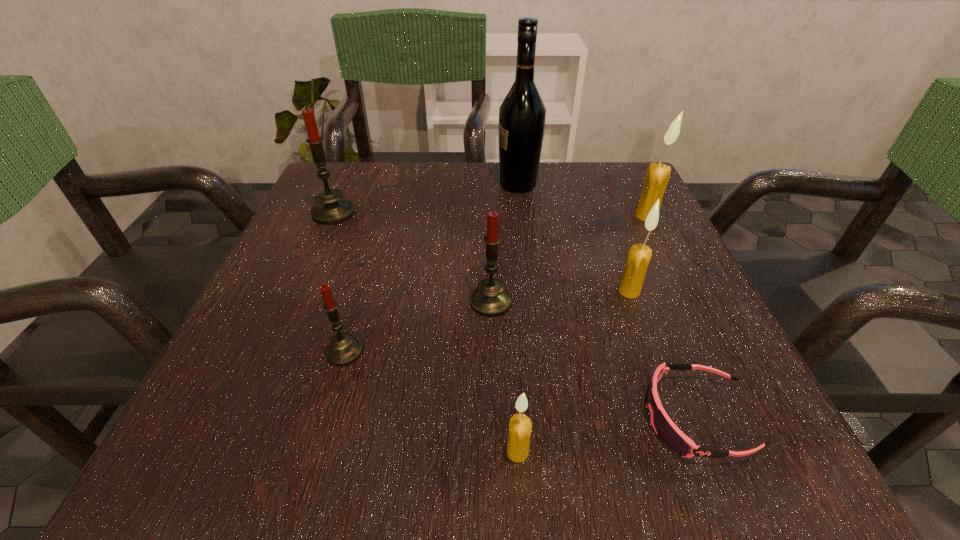
What are the coordinates of `black wine bottle` in the screenshot? It's located at (522, 114).

The width and height of the screenshot is (960, 540). I want to click on the tallest object, so click(522, 114).

Where is `the leftmost candle`? This screenshot has width=960, height=540. the leftmost candle is located at coordinates pos(331,209).

Where is `the biggest red candle`? the biggest red candle is located at coordinates [x=331, y=209].

Where is `the rightmost candle`? The height and width of the screenshot is (540, 960). the rightmost candle is located at coordinates 655,183.

Identify the location of the farthest cream candle. The image size is (960, 540). (655, 183).

Where is `the rightmost red candle`? the rightmost red candle is located at coordinates (490, 299).

Locate an element on the screen. This screenshot has height=540, width=960. the second farthest red candle is located at coordinates (490, 299).

Identify the location of the second farthest cream candle. (639, 256).

The width and height of the screenshot is (960, 540). I want to click on the fifth candle from left to right, so click(x=639, y=256).